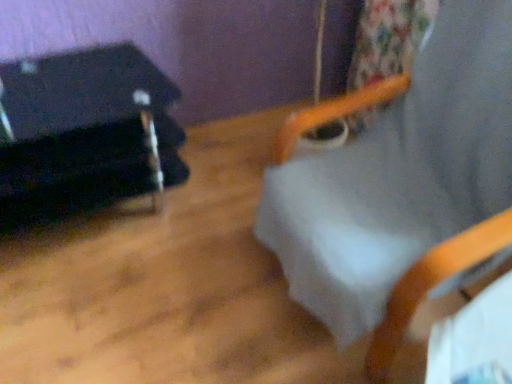
The height and width of the screenshot is (384, 512). Describe the element at coordinates (84, 135) in the screenshot. I see `black fabric at left` at that location.

Measure the distance between black fabric at left and camera.

black fabric at left is 1.23 meters away from camera.

I want to click on black fabric at left, so click(x=84, y=135).

Identify the location of white fabric beach chair at upper center. The height and width of the screenshot is (384, 512). (403, 187).

Looking at this image, measure the distance between point (503, 199) and camera.

The distance of point (503, 199) from camera is 3.71 feet.

What is the approximate height of white fabric beach chair at upper center?

It is 3.53 feet.

Describe the element at coordinates (403, 187) in the screenshot. I see `white fabric beach chair at upper center` at that location.

The width and height of the screenshot is (512, 384). I want to click on black fabric at left, so click(84, 135).

Considering the positions of objects black fabric at left and white fabric beach chair at upper center in the image provided, who is more to the left, black fabric at left or white fabric beach chair at upper center?

From the viewer's perspective, black fabric at left appears more on the left side.

Does black fabric at left lie in front of white fabric beach chair at upper center?

That is False.

Does point (3, 193) come farther from viewer compared to point (324, 263)?

Yes, it is behind point (324, 263).

From the image's perspective, relative to white fabric beach chair at upper center, is black fabric at left above or below?

Clearly, from the image's perspective, black fabric at left is above white fabric beach chair at upper center.

Based on the photo, from a real-world perspective, is black fabric at left over white fabric beach chair at upper center?

No, from a real-world perspective, black fabric at left is not over white fabric beach chair at upper center

Is black fabric at left wider than white fabric beach chair at upper center?

No.

From their relative heights in the image, would you say black fabric at left is taller or shorter than white fabric beach chair at upper center?

Considering their sizes, black fabric at left has less height than white fabric beach chair at upper center.

Considering the relative sizes of black fabric at left and white fabric beach chair at upper center in the image provided, is black fabric at left smaller than white fabric beach chair at upper center?

Indeed, black fabric at left has a smaller size compared to white fabric beach chair at upper center.

Is white fabric beach chair at upper center completely or partially inside black fabric at left?

No, white fabric beach chair at upper center is located outside of black fabric at left.

Can you see black fabric at left touching white fabric beach chair at upper center?

No, black fabric at left is not in contact with white fabric beach chair at upper center.

Is black fabric at left oriented towards white fabric beach chair at upper center?

No, black fabric at left is not oriented towards white fabric beach chair at upper center.

Can you tell me how much black fabric at left and white fabric beach chair at upper center differ in facing direction?

The angular difference between black fabric at left and white fabric beach chair at upper center is 90 degrees.

Find the location of a particular element. beach chair on the right of black fabric at left is located at coordinates (403, 187).

Which is more to the right, white fabric beach chair at upper center or black fabric at left?

white fabric beach chair at upper center.

Does white fabric beach chair at upper center come behind black fabric at left?

That is False.

Which point is more forward, (467, 7) or (44, 182)?

The point (467, 7) is closer.

From the image's perspective, is white fabric beach chair at upper center located above black fabric at left?

No, from the image's perspective, white fabric beach chair at upper center is not on top of black fabric at left.

From a real-world perspective, is white fabric beach chair at upper center physically below black fabric at left?

No, from a real-world perspective, white fabric beach chair at upper center is not beneath black fabric at left.

In the scene shown: Can you confirm if white fabric beach chair at upper center is thinner than black fabric at left?

No.

Considering the sizes of white fabric beach chair at upper center and black fabric at left in the image, is white fabric beach chair at upper center taller or shorter than black fabric at left?

Clearly, white fabric beach chair at upper center is taller compared to black fabric at left.

Consider the image. Between white fabric beach chair at upper center and black fabric at left, which one has smaller size?

With smaller size is black fabric at left.

Is white fabric beach chair at upper center spatially inside black fabric at left, or outside of it?

white fabric beach chair at upper center exists outside the volume of black fabric at left.

Does white fabric beach chair at upper center touch black fabric at left?

No, white fabric beach chair at upper center is not with black fabric at left.

Could you tell me if white fabric beach chair at upper center is facing black fabric at left?

No, white fabric beach chair at upper center is not aimed at black fabric at left.

Measure the distance between white fabric beach chair at upper center and black fabric at left.

A distance of 69.81 centimeters exists between white fabric beach chair at upper center and black fabric at left.

Where is `furniture on the left side of white fabric beach chair at upper center`? The height and width of the screenshot is (384, 512). furniture on the left side of white fabric beach chair at upper center is located at coordinates (84, 135).

Locate an element on the screen. beach chair that appears below the black fabric at left (from the image's perspective) is located at coordinates (403, 187).

This screenshot has width=512, height=384. What are the coordinates of `furniture on the left of white fabric beach chair at upper center` in the screenshot? It's located at (84, 135).